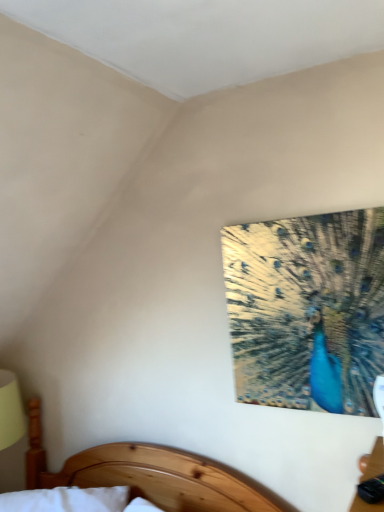
The height and width of the screenshot is (512, 384). What do you see at coordinates (150, 475) in the screenshot? I see `wooden bed at lower center` at bounding box center [150, 475].

Find the location of a particular element. Image resolution: width=384 pixels, height=512 pixels. wooden bed at lower center is located at coordinates (150, 475).

What is the approximate width of wooden bed at lower center?

wooden bed at lower center is 7.53 inches wide.

The width and height of the screenshot is (384, 512). Describe the element at coordinates (307, 310) in the screenshot. I see `shiny metallic peacock at upper right` at that location.

This screenshot has width=384, height=512. In order to click on shiny metallic peacock at upper right in this screenshot , I will do `click(307, 310)`.

Where is `wooden bed at lower center`? wooden bed at lower center is located at coordinates (150, 475).

In the image, is shiny metallic peacock at upper right on the left side or the right side of wooden bed at lower center?

shiny metallic peacock at upper right is to the right of wooden bed at lower center.

In the image, is shiny metallic peacock at upper right positioned in front of or behind wooden bed at lower center?

shiny metallic peacock at upper right is behind wooden bed at lower center.

Considering the positions of points (284, 258) and (106, 475), is point (284, 258) farther from camera compared to point (106, 475)?

No, it is in front of (106, 475).

Consider the image. From the image's perspective, would you say shiny metallic peacock at upper right is shown under wooden bed at lower center?

No, from the image's perspective, shiny metallic peacock at upper right is not beneath wooden bed at lower center.

From a real-world perspective, between shiny metallic peacock at upper right and wooden bed at lower center, who is vertically higher?

In real-world perspective, shiny metallic peacock at upper right is above.

In terms of width, does shiny metallic peacock at upper right look wider or thinner when compared to wooden bed at lower center?

Clearly, shiny metallic peacock at upper right has less width compared to wooden bed at lower center.

Which of these two, shiny metallic peacock at upper right or wooden bed at lower center, stands taller?

shiny metallic peacock at upper right is taller.

Looking at the image, does shiny metallic peacock at upper right seem bigger or smaller compared to wooden bed at lower center?

Clearly, shiny metallic peacock at upper right is smaller in size than wooden bed at lower center.

From the picture: Is wooden bed at lower center a part of shiny metallic peacock at upper right?

No, wooden bed at lower center is not a part of shiny metallic peacock at upper right.

Looking at this image, are shiny metallic peacock at upper right and wooden bed at lower center beside each other?

No, shiny metallic peacock at upper right is not next to wooden bed at lower center.

Could you tell me if shiny metallic peacock at upper right is turned towards wooden bed at lower center?

No, shiny metallic peacock at upper right is not aimed at wooden bed at lower center.

How many degrees apart are the facing directions of shiny metallic peacock at upper right and wooden bed at lower center?

The facing directions of shiny metallic peacock at upper right and wooden bed at lower center are 21.4 degrees apart.

The image size is (384, 512). In order to click on peacock above the wooden bed at lower center (from a real-world perspective) in this screenshot , I will do `click(307, 310)`.

Which object is positioned more to the left, wooden bed at lower center or shiny metallic peacock at upper right?

From the viewer's perspective, wooden bed at lower center appears more on the left side.

Relative to shiny metallic peacock at upper right, is wooden bed at lower center in front or behind?

Visually, wooden bed at lower center is located in front of shiny metallic peacock at upper right.

Does point (125, 455) appear closer or farther from the camera than point (314, 349)?

Point (125, 455) is farther from the camera than point (314, 349).

From the image's perspective, is wooden bed at lower center located beneath shiny metallic peacock at upper right?

Yes, from the image's perspective, wooden bed at lower center is beneath shiny metallic peacock at upper right.

Looking at this image, from a real-world perspective, which object rests below the other?

→ wooden bed at lower center is physically lower.

Which of these two, wooden bed at lower center or shiny metallic peacock at upper right, is thinner?

Thinner between the two is shiny metallic peacock at upper right.

Between wooden bed at lower center and shiny metallic peacock at upper right, which one has more height?

shiny metallic peacock at upper right.

Looking at the image, does wooden bed at lower center seem bigger or smaller compared to shiny metallic peacock at upper right?

Clearly, wooden bed at lower center is larger in size than shiny metallic peacock at upper right.

Is shiny metallic peacock at upper right a part of wooden bed at lower center?

No.

Is the surface of wooden bed at lower center in direct contact with shiny metallic peacock at upper right?

wooden bed at lower center and shiny metallic peacock at upper right are clearly separated.

Does wooden bed at lower center turn towards shiny metallic peacock at upper right?

No, wooden bed at lower center is not aimed at shiny metallic peacock at upper right.

How different are the orientations of wooden bed at lower center and shiny metallic peacock at upper right in degrees?

There is a 21.4-degree angle between the facing directions of wooden bed at lower center and shiny metallic peacock at upper right.

Looking at this image, how far apart are wooden bed at lower center and shiny metallic peacock at upper right?

A distance of 24.31 inches exists between wooden bed at lower center and shiny metallic peacock at upper right.

Identify the location of peacock behind the wooden bed at lower center. (307, 310).

What are the coordinates of `peacock on the right of the wooden bed at lower center` in the screenshot? It's located at click(x=307, y=310).

This screenshot has height=512, width=384. In order to click on bed that is below the shiny metallic peacock at upper right (from the image's perspective) in this screenshot , I will do `click(150, 475)`.